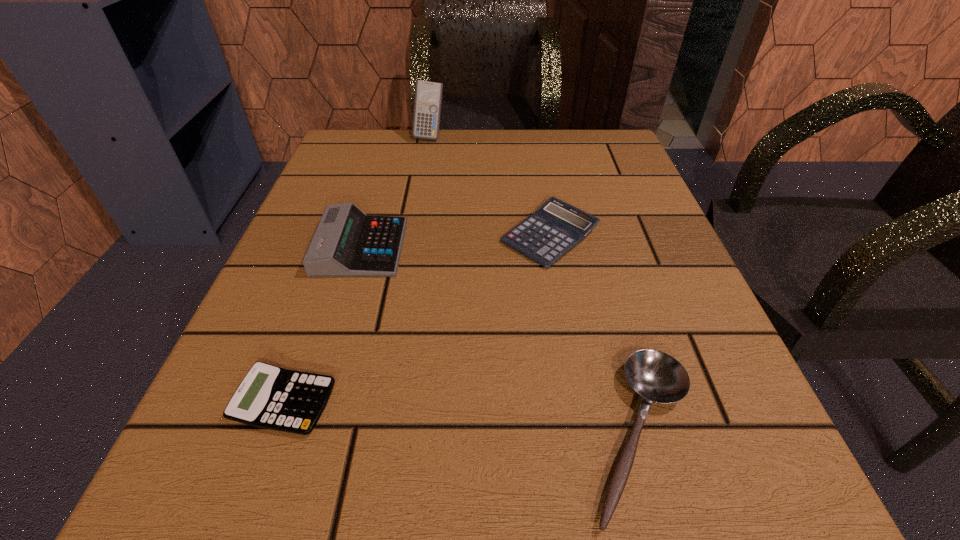
Image resolution: width=960 pixels, height=540 pixels. I want to click on vacant region that satisfies the following two spatial constraints: 1. on the front side of the ladle; 2. on the left side of the nearest calculator, so click(x=274, y=434).

Where is `free spot that satisfies the following two spatial constraints: 1. on the front-facing side of the rightmost calculator; 2. on the right side of the farthest calculator`? This screenshot has height=540, width=960. free spot that satisfies the following two spatial constraints: 1. on the front-facing side of the rightmost calculator; 2. on the right side of the farthest calculator is located at coordinates (412, 236).

Where is `free location that satisfies the following two spatial constraints: 1. on the back side of the rightmost calculator; 2. on the left side of the fourth shortest object`? This screenshot has width=960, height=540. free location that satisfies the following two spatial constraints: 1. on the back side of the rightmost calculator; 2. on the left side of the fourth shortest object is located at coordinates coord(365,236).